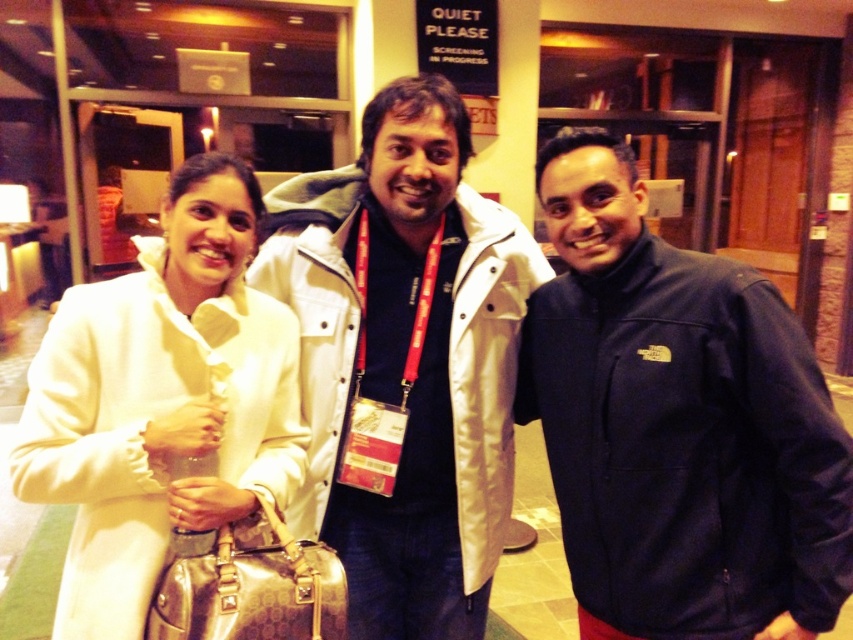
Which is below, dark blue fleece jacket at center or white leather jacket at center?

→ dark blue fleece jacket at center

Is point (560, 508) closer to viewer compared to point (192, 483)?

No.

The width and height of the screenshot is (853, 640). Find the location of `dark blue fleece jacket at center`. dark blue fleece jacket at center is located at coordinates (677, 422).

Is dark blue fleece jacket at center above white matte jacket at center?

Incorrect, dark blue fleece jacket at center is not positioned above white matte jacket at center.

Between dark blue fleece jacket at center and white matte jacket at center, which one has less height?

Standing shorter between the two is dark blue fleece jacket at center.

Locate an element on the screen. dark blue fleece jacket at center is located at coordinates (x=677, y=422).

Is white matte jacket at center in front of white leather jacket at center?

No, white matte jacket at center is further to the viewer.

Who is taller, white matte jacket at center or white leather jacket at center?

white matte jacket at center is taller.

Which is in front, point (325, 252) or point (123, 522)?

Point (123, 522) is in front.

I want to click on white matte jacket at center, so click(x=405, y=358).